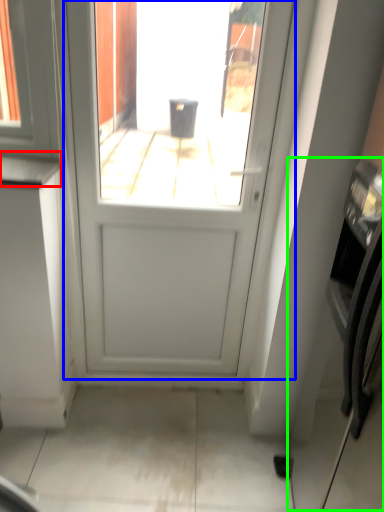
Question: Which object is positioned closest to counter top (highlighted by a red box)? Select from door (highlighted by a blue box) and oven (highlighted by a green box).

Choices:
 (A) door
 (B) oven

Answer: (A)